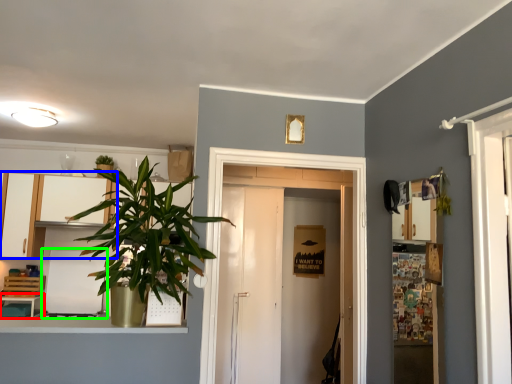
Question: Based on their relative distances, which object is farther from table (highlighted by a red box)? Choose from cabinetry (highlighted by a blue box) and appliance (highlighted by a green box).

Choices:
 (A) cabinetry
 (B) appliance

Answer: (A)